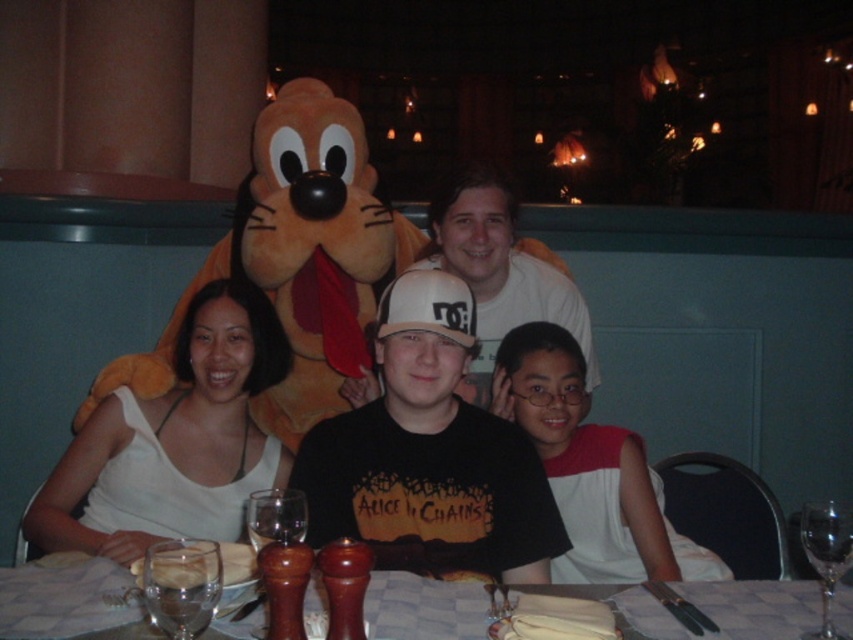
Is wooden table at center wider than white matte shirt at center?

Yes, wooden table at center is wider than white matte shirt at center.

Between point (727, 609) and point (654, 536), which one is positioned in front?

Positioned in front is point (727, 609).

Identify the location of wooden table at center. (61, 600).

Is white fabric shirt at center positioned before wooden table at center?

No, white fabric shirt at center is further to the viewer.

Which is behind, point (65, 451) or point (51, 636)?

Positioned behind is point (65, 451).

Between point (120, 538) and point (479, 608), which one is positioned in front?

Point (479, 608) is more forward.

Locate an element on the screen. white fabric shirt at center is located at coordinates (173, 442).

Between white fabric shirt at center and white matte shirt at center, which one has more height?

white matte shirt at center is taller.

Which is more to the right, white fabric shirt at center or white matte shirt at center?

From the viewer's perspective, white matte shirt at center appears more on the right side.

Does point (126, 529) come in front of point (573, 368)?

Yes, it is in front of point (573, 368).

Where is `white fabric shirt at center`? white fabric shirt at center is located at coordinates (173, 442).